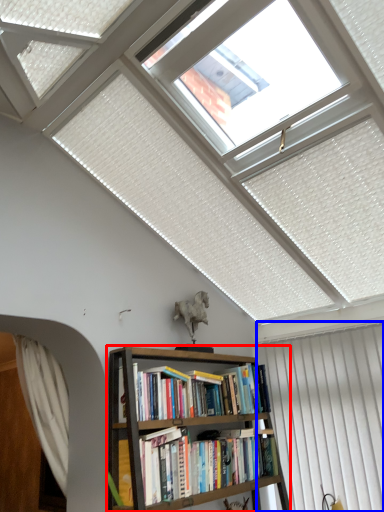
Question: Among these objects, which one is farthest to the camera, bookcase (highlighted by a red box) or curtain (highlighted by a blue box)?

Choices:
 (A) bookcase
 (B) curtain

Answer: (B)